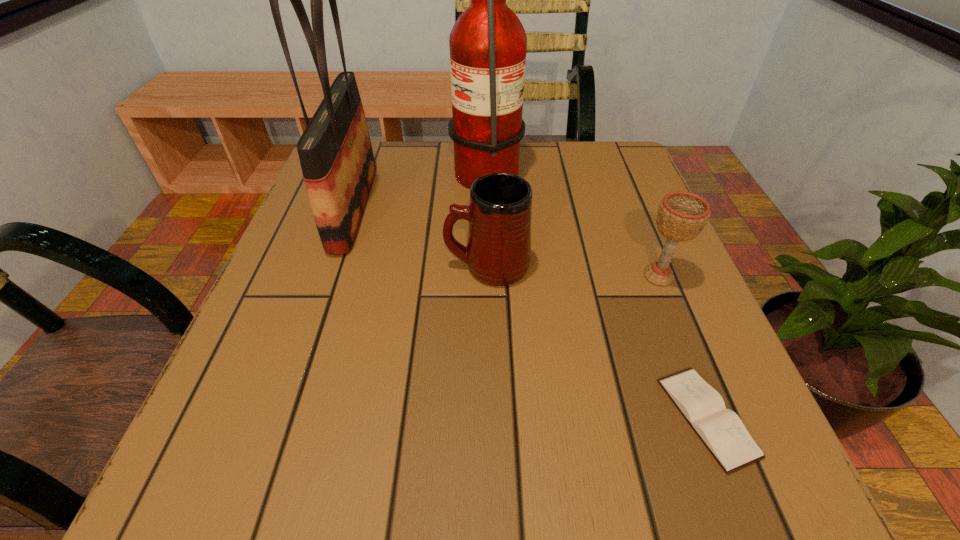
Where is `blank area in the image that satisfies the following two spatial constraints: 1. on the side of the mug with the handle; 2. on the right side of the shortest object`? This screenshot has width=960, height=540. blank area in the image that satisfies the following two spatial constraints: 1. on the side of the mug with the handle; 2. on the right side of the shortest object is located at coordinates (490, 417).

At what (x,y) coordinates should I click in order to perform the action: click on vacant space that satisfies the following two spatial constraints: 1. on the side of the shortest object with the handle; 2. on the right side of the mug. Please return your answer as a coordinate pair (x, y). The height and width of the screenshot is (540, 960). Looking at the image, I should click on (490, 417).

Locate an element on the screen. Image resolution: width=960 pixels, height=540 pixels. free space that satisfies the following two spatial constraints: 1. on the front-facing side of the chalice; 2. on the left side of the shopping bag is located at coordinates (330, 276).

Find the location of a particular element. This screenshot has width=960, height=540. free space that satisfies the following two spatial constraints: 1. on the side of the shortest object with the handle; 2. on the left side of the mug is located at coordinates (490, 417).

Find the location of `free spot that satisfies the following two spatial constraints: 1. on the side of the diary with the handle; 2. on the right side of the mug`. free spot that satisfies the following two spatial constraints: 1. on the side of the diary with the handle; 2. on the right side of the mug is located at coordinates [490, 417].

In order to click on vacant space that satisfies the following two spatial constraints: 1. on the side of the diary with the handle; 2. on the right side of the mug in this screenshot , I will do `click(490, 417)`.

Where is `free location that satisfies the following two spatial constraints: 1. on the back side of the shortest object; 2. on the front-facing side of the leftmost object`? free location that satisfies the following two spatial constraints: 1. on the back side of the shortest object; 2. on the front-facing side of the leftmost object is located at coordinates (625, 208).

Identify the location of free space that satisfies the following two spatial constraints: 1. on the nozzle and handle of the shortest object; 2. on the right side of the fire extinguisher. Image resolution: width=960 pixels, height=540 pixels. (491, 417).

Locate an element on the screen. This screenshot has width=960, height=540. free location that satisfies the following two spatial constraints: 1. on the side of the mug with the handle; 2. on the left side of the shortest object is located at coordinates (490, 417).